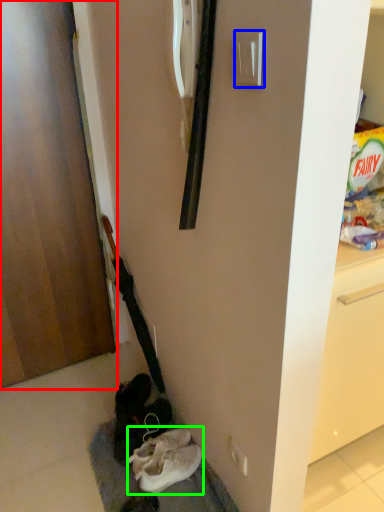
Question: Which is nearer to the door (highlighted by a red box)? door handle (highlighted by a blue box) or footwear (highlighted by a green box).

Choices:
 (A) door handle
 (B) footwear

Answer: (B)